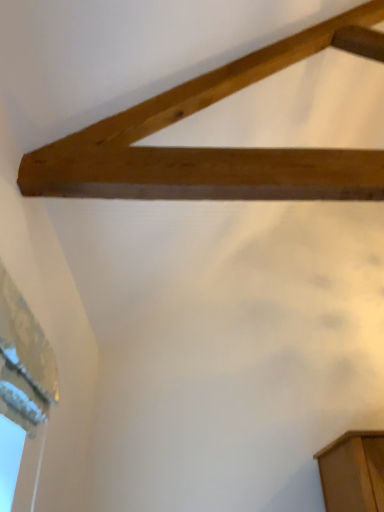
Question: From a real-world perspective, is white textured paper at upper left located beneath natural wood plank at upper center?

Choices:
 (A) yes
 (B) no

Answer: (A)

Question: Is white textured paper at upper left outside of natural wood plank at upper center?

Choices:
 (A) yes
 (B) no

Answer: (A)

Question: From the image's perspective, is white textured paper at upper left on natural wood plank at upper center?

Choices:
 (A) no
 (B) yes

Answer: (A)

Question: Considering the relative sizes of white textured paper at upper left and natural wood plank at upper center in the image provided, is white textured paper at upper left shorter than natural wood plank at upper center?

Choices:
 (A) no
 (B) yes

Answer: (B)

Question: From the image's perspective, is white textured paper at upper left under natural wood plank at upper center?

Choices:
 (A) no
 (B) yes

Answer: (B)

Question: From a real-world perspective, does white textured paper at upper left stand above natural wood plank at upper center?

Choices:
 (A) yes
 (B) no

Answer: (B)

Question: Considering the relative positions of natural wood plank at upper center and white textured paper at upper left in the image provided, is natural wood plank at upper center behind white textured paper at upper left?

Choices:
 (A) no
 (B) yes

Answer: (B)

Question: Is natural wood plank at upper center at the right side of white textured paper at upper left?

Choices:
 (A) yes
 (B) no

Answer: (A)

Question: Is natural wood plank at upper center oriented towards white textured paper at upper left?

Choices:
 (A) no
 (B) yes

Answer: (A)

Question: Is natural wood plank at upper center wider than white textured paper at upper left?

Choices:
 (A) yes
 (B) no

Answer: (A)

Question: From a real-world perspective, is natural wood plank at upper center positioned under white textured paper at upper left based on gravity?

Choices:
 (A) yes
 (B) no

Answer: (B)

Question: From the image's perspective, is natural wood plank at upper center on white textured paper at upper left?

Choices:
 (A) no
 (B) yes

Answer: (B)

Question: Based on their positions, is natural wood plank at upper center located to the left or right of white textured paper at upper left?

Choices:
 (A) right
 (B) left

Answer: (A)